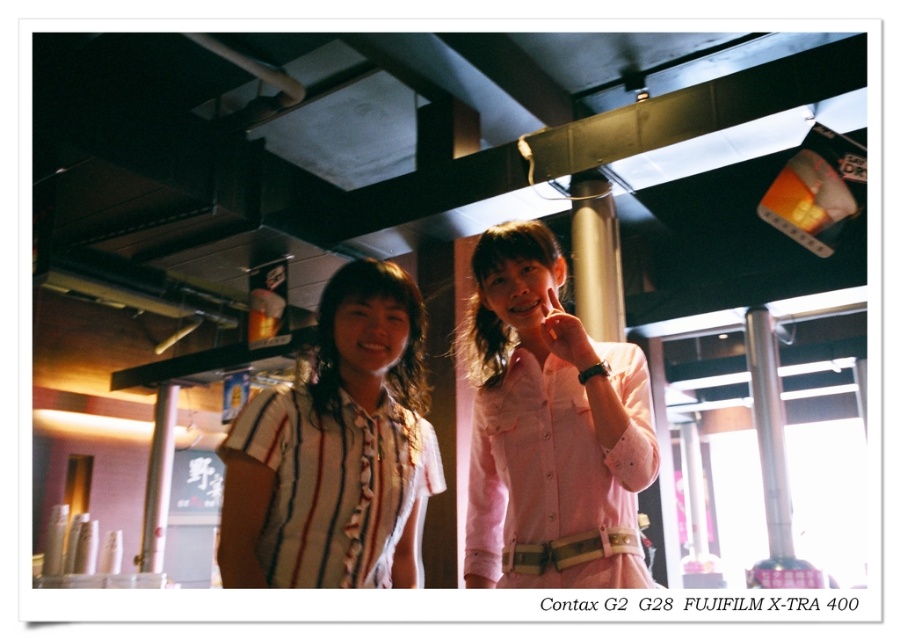
You are a photographer setting up a shot in a cozy indoor space with exposed ceiling beams. You notice two shirts in the frame, the striped cotton shirt at center and the white striped fabric shirt at left. You want to ensure there is at least 5 inches of space between them for proper composition. Based on the scene, is the current distance sufficient?

The striped cotton shirt at center and the white striped fabric shirt at left are 4.22 inches apart from each other, which is less than the required 5 inches. Therefore, the current distance is insufficient for proper composition.

You are a photographer setting up for a group photo. You want both the pink satin shirt at center and the white striped fabric shirt at left to be clearly visible in the shot. Given their current positions, which shirt should you adjust to ensure both are fully visible?

The white striped fabric shirt at left is behind the pink satin shirt at center. To ensure both are fully visible, you should move the white striped fabric shirt at left forward so it is no longer obscured by the pink satin shirt at center.

You are designing a new clothing rack and need to arrange the striped cotton shirt at center and the pink satin shirt at center side by side. Which shirt should be placed first to accommodate their widths properly?

The striped cotton shirt at center should be placed first since it is wider than the pink satin shirt at center, ensuring there is enough space for both shirts on the rack.